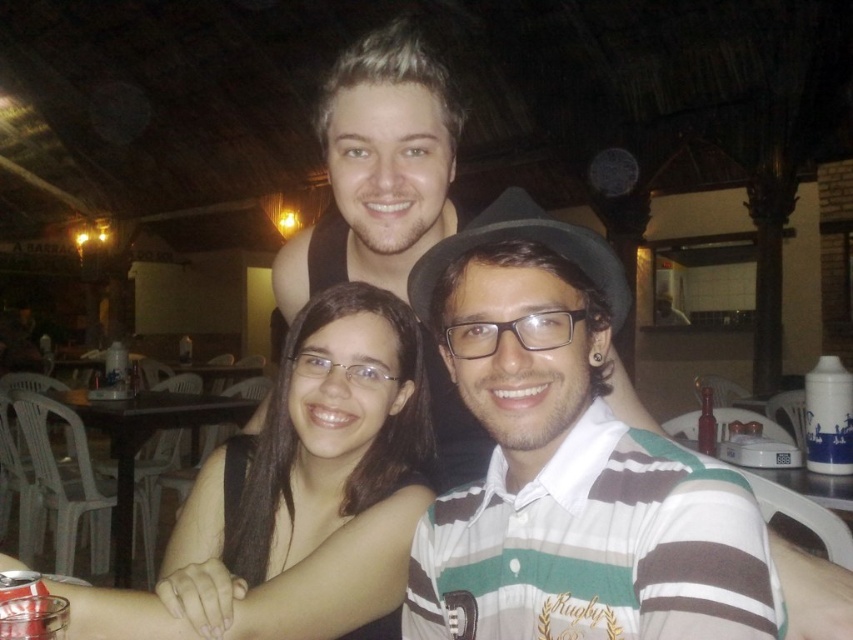
You are a photographer standing at the back of the room. You want to take a photo of the black matte hair at center and the black plastic table at lower left in the same frame. Can you position yourself so that both are in focus without moving either object? Explain why or why not.

The black matte hair at center and the black plastic table at lower left are 2.37 meters apart from each other. Since the distance between them is significant, the photographer can position themselves far enough away to ensure both are within the depth of field, allowing both to be in focus simultaneously.

You are taking a photo of two points in the image. The first point is labeled as point (431, 572) and the second is point (138, 392). Which point is closer to the camera?

Point (431, 572) is closer to the camera than point (138, 392).